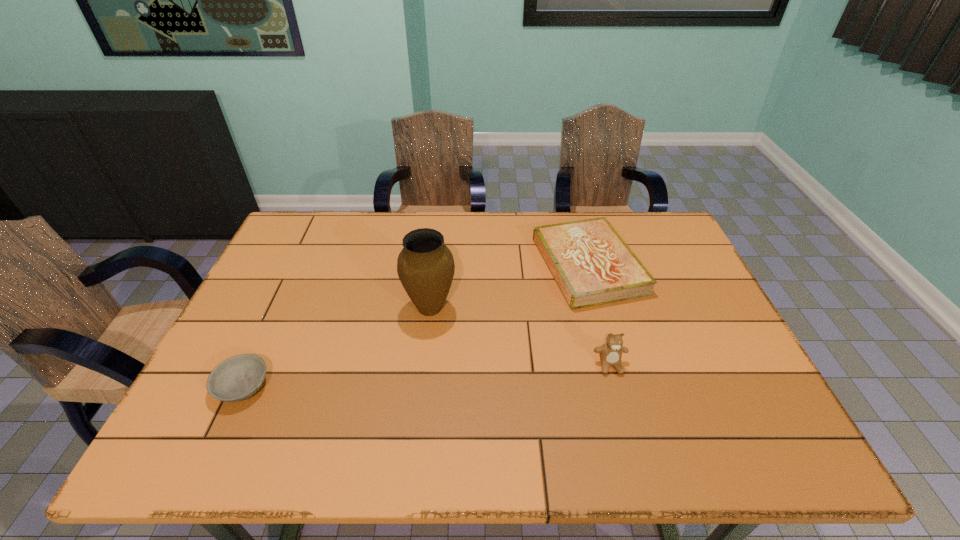
Select which object appears as the second closest to the hardback book. Please provide its 2D coordinates. Your answer should be formatted as a tuple, i.e. [(x, y)], where the tuple contains the x and y coordinates of a point satisfying the conditions above.

[(425, 266)]

I want to click on the closest object to the leftmost object, so click(x=425, y=266).

The width and height of the screenshot is (960, 540). Find the location of `vacant space that satisfies the following two spatial constraints: 1. on the back side of the urn; 2. on the right side of the shortest object`. vacant space that satisfies the following two spatial constraints: 1. on the back side of the urn; 2. on the right side of the shortest object is located at coordinates (279, 307).